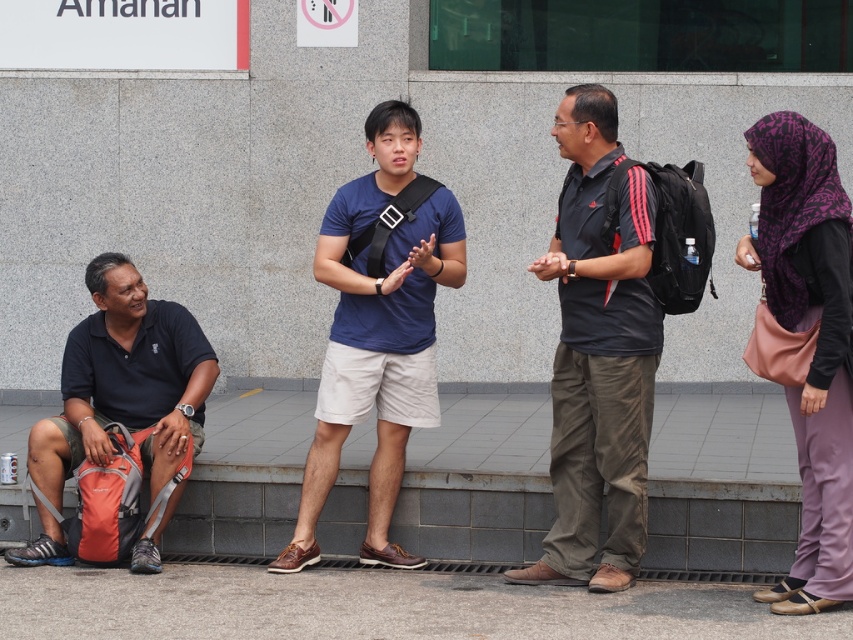
Describe the element at coordinates (374, 605) in the screenshot. I see `gray concrete pavement at lower center` at that location.

Can you confirm if gray concrete pavement at lower center is positioned below blue cotton t-shirt at center?

Correct, gray concrete pavement at lower center is located below blue cotton t-shirt at center.

Between point (109, 611) and point (409, 412), which one is positioned behind?

The point (409, 412) is more distant.

Identify the location of gray concrete pavement at lower center. The height and width of the screenshot is (640, 853). (374, 605).

Measure the distance from gray concrete pavement at lower center to black fabric backpack at lower left.

gray concrete pavement at lower center and black fabric backpack at lower left are 95.90 centimeters apart from each other.

Describe the element at coordinates (374, 605) in the screenshot. I see `gray concrete pavement at lower center` at that location.

Who is more forward, (675, 600) or (51, 458)?

Point (675, 600)

Where is `gray concrete pavement at lower center`? Image resolution: width=853 pixels, height=640 pixels. gray concrete pavement at lower center is located at coordinates (374, 605).

Between gray concrete pavement at lower center and black matte shirt at center, which one is positioned lower?

gray concrete pavement at lower center is below.

Does gray concrete pavement at lower center appear on the left side of black matte shirt at center?

Indeed, gray concrete pavement at lower center is positioned on the left side of black matte shirt at center.

Which is in front, point (548, 611) or point (554, 404)?

Point (548, 611)

I want to click on gray concrete pavement at lower center, so click(x=374, y=605).